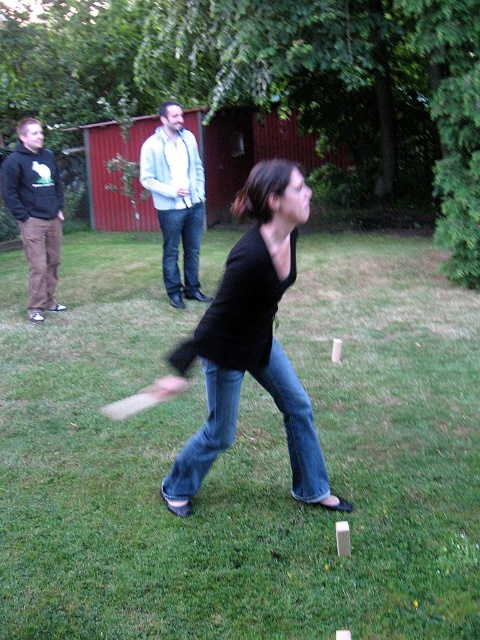
Question: Where is green grass at center located in relation to black matte shirt at center in the image?

Choices:
 (A) below
 (B) above

Answer: (A)

Question: Is denim jeans at center below light blue denim jeans at center?

Choices:
 (A) no
 (B) yes

Answer: (B)

Question: Which object is the closest to the dark brown hoodie at left?

Choices:
 (A) light blue denim jeans at center
 (B) black matte shirt at center

Answer: (A)

Question: Which point is farther to the camera?

Choices:
 (A) (278, 355)
 (B) (166, 257)
 (C) (320, 449)
 (D) (450, 508)

Answer: (B)

Question: Which of these objects is positioned farthest from the denim jeans at center?

Choices:
 (A) dark brown hoodie at left
 (B) black matte shirt at center

Answer: (A)

Question: Is light blue denim jeans at center positioned at the back of dark brown hoodie at left?

Choices:
 (A) no
 (B) yes

Answer: (B)